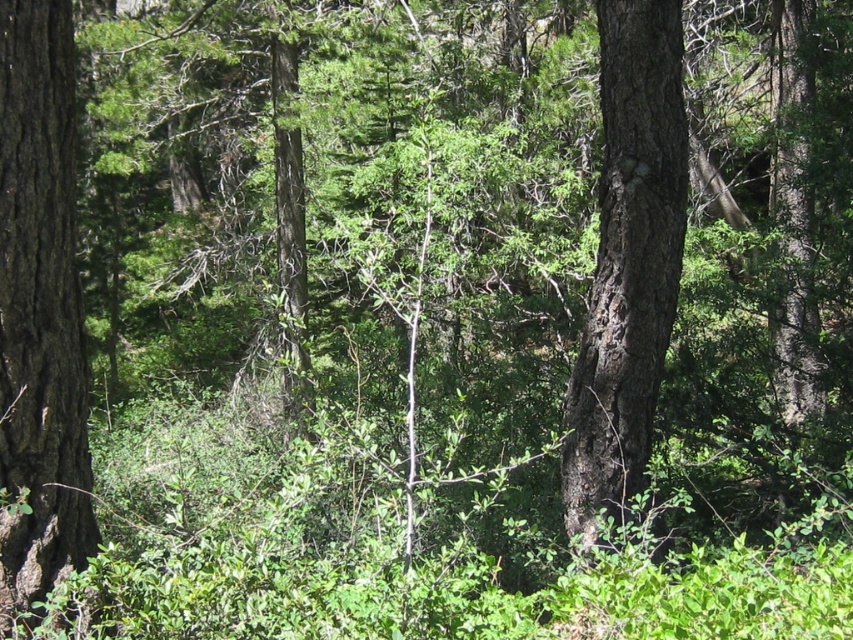
You are a hiker trying to navigate through the forest. You see the smooth brown bark at left and the dark brown bark tree at center. Which direction should you go to avoid the dense undergrowth?

The smooth brown bark at left is below the dark brown bark tree at center, so going towards the dark brown bark tree at center would avoid the dense undergrowth near the smooth brown bark at left.

You are a hiker trying to navigate through the forest. You see the smooth brown bark at left and the dark brown bark tree at center. Which tree is closer to your left side?

The smooth brown bark at left is positioned on the left side of dark brown bark tree at center, so it is closer to your left side.

In the scene shown: You are a hiker navigating through the forest and want to reach a clearing beyond the trees. You see the smooth brown bark at left and the dark brown bark tree at center. Which tree should you walk around to get closer to the clearing?

The smooth brown bark at left is in front of the dark brown bark tree at center, so you should walk around the smooth brown bark at left to get closer to the clearing.